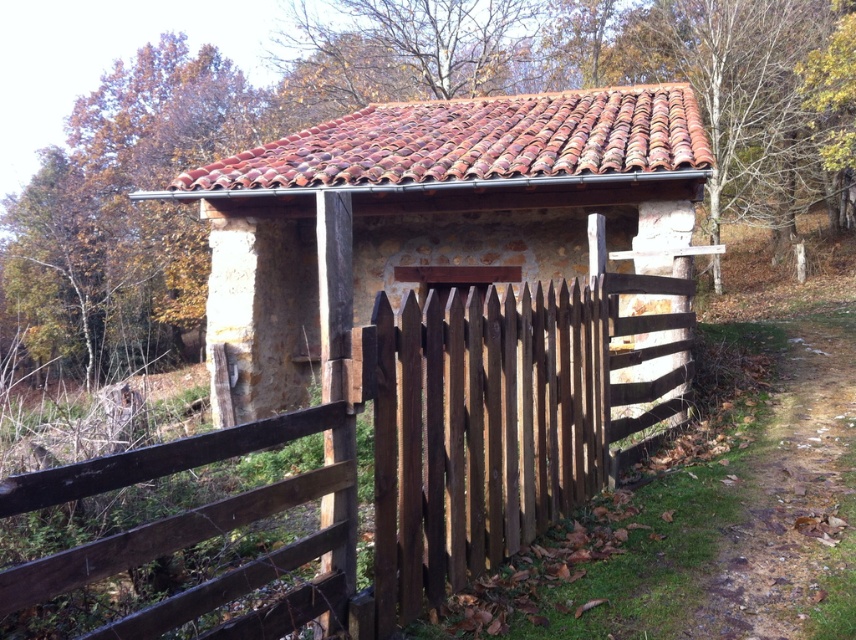
Question: Is brown wooden fence at center closer to the viewer compared to brown stone hut at center?

Choices:
 (A) no
 (B) yes

Answer: (B)

Question: Is brown wooden fence at center above brown stone hut at center?

Choices:
 (A) yes
 (B) no

Answer: (B)

Question: Is brown wooden fence at center positioned at the back of brown stone hut at center?

Choices:
 (A) no
 (B) yes

Answer: (A)

Question: Which object is closer to the camera taking this photo?

Choices:
 (A) brown stone hut at center
 (B) brown wooden fence at center

Answer: (B)

Question: Among these points, which one is nearest to the camera?

Choices:
 (A) click(562, 284)
 (B) click(590, 93)

Answer: (A)